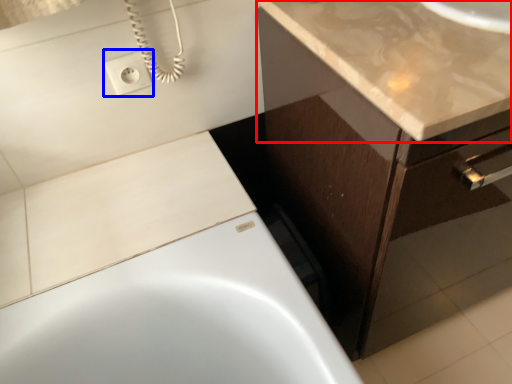
Question: Which object is closer to the camera taking this photo, countertop (highlighted by a red box) or electric outlet (highlighted by a blue box)?

Choices:
 (A) countertop
 (B) electric outlet

Answer: (A)